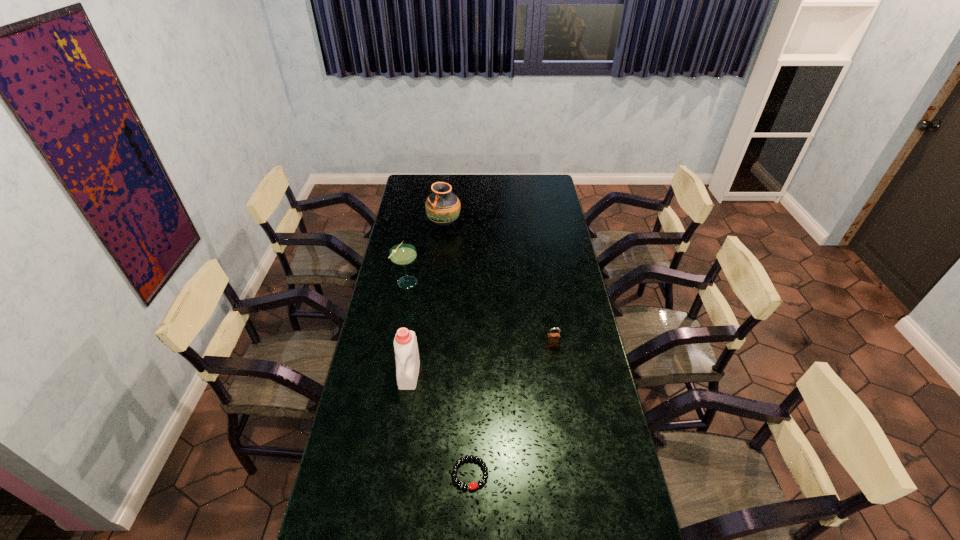
The height and width of the screenshot is (540, 960). I want to click on free spot located 0.240m on the front of the martini, so click(397, 334).

Locate an element on the screen. free space located on the front-facing side of the padlock is located at coordinates (556, 362).

This screenshot has height=540, width=960. I want to click on free space located 0.250m on the back of the shortest object, so (x=471, y=388).

Image resolution: width=960 pixels, height=540 pixels. Identify the location of pottery positioned at the left edge. (442, 207).

The width and height of the screenshot is (960, 540). I want to click on detergent that is at the left edge, so click(x=405, y=343).

Find the location of a particular element. Image resolution: width=960 pixels, height=540 pixels. martini that is at the left edge is located at coordinates (402, 254).

This screenshot has height=540, width=960. Identify the location of object at the right edge. (553, 339).

This screenshot has height=540, width=960. In the image, there is a desktop. In order to click on vacant space at the far edge in this screenshot , I will do `click(464, 194)`.

In the image, there is a desktop. What are the coordinates of `free space at the left edge` in the screenshot? It's located at (x=385, y=269).

I want to click on vacant space at the right edge, so click(551, 274).